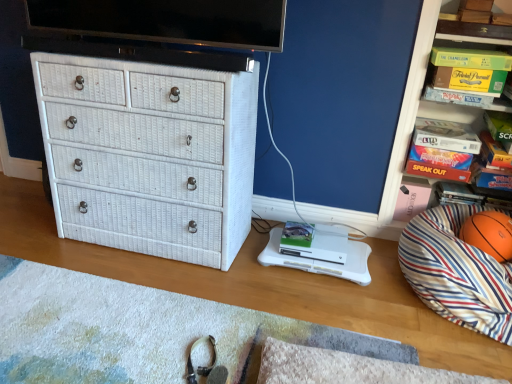
What do you see at coordinates (489, 234) in the screenshot?
I see `orange rubber basketball at right` at bounding box center [489, 234].

The image size is (512, 384). What are the coordinates of `orange matte basketball at right` in the screenshot? It's located at (426, 72).

Is white wicker chest of drawers at left directly adjacent to orange rubber basketball at right?

No, white wicker chest of drawers at left is not making contact with orange rubber basketball at right.

From the picture: Which point is more distant from viewer, (65, 88) or (473, 236)?

The point (473, 236) is farther from the camera.

Between white wicker chest of drawers at left and orange rubber basketball at right, which one has larger size?

white wicker chest of drawers at left is bigger.

Does point (362, 348) appear closer or farther from the camera than point (431, 52)?

Point (362, 348) is closer to the camera than point (431, 52).

Which object is wider, white textured mat at lower center or green cardboard game at upper right?

With larger width is white textured mat at lower center.

Find the location of `book that is on the right side of white textured mat at lower center`. book that is on the right side of white textured mat at lower center is located at coordinates (471, 58).

Is white textured mat at lower center in front of or behind green cardboard game at upper right in the image?

Visually, white textured mat at lower center is located in front of green cardboard game at upper right.

Based on the photo, from the image's perspective, which one is positioned higher, orange matte basketball at right or green cardboard game at upper right?

green cardboard game at upper right is shown above in the image.

You are a GUI agent. You are given a task and a screenshot of the screen. Output one action in this format:
    pyautogui.click(x=<x>, y=<y>)
    Task: Click on the book behind the orange matte basketball at right
    The width and height of the screenshot is (512, 384).
    Given the screenshot: What is the action you would take?
    pyautogui.click(x=471, y=58)

Who is shorter, orange matte basketball at right or green cardboard game at upper right?

Standing shorter between the two is green cardboard game at upper right.

From a real-world perspective, is black glossy flat-screen tv at upper center physically located above or below green cardboard game at upper right?

From a real-world perspective, black glossy flat-screen tv at upper center is physically above green cardboard game at upper right.

Is black glossy flat-screen tv at upper center with green cardboard game at upper right?

There is a gap between black glossy flat-screen tv at upper center and green cardboard game at upper right.

Which object is positioned more to the right, black glossy flat-screen tv at upper center or green cardboard game at upper right?

green cardboard game at upper right is more to the right.

Is green cardboard box at upper right positioned before green cardboard game at upper right?

No.

Considering the relative sizes of green cardboard box at upper right and green cardboard game at upper right in the image provided, is green cardboard box at upper right shorter than green cardboard game at upper right?

No.

Is green cardboard box at upper right aimed at green cardboard game at upper right?

No, green cardboard box at upper right is not aimed at green cardboard game at upper right.

Is striped fabric bean bag at right oriented towards black glossy flat-screen tv at upper center?

No, striped fabric bean bag at right does not turn towards black glossy flat-screen tv at upper center.

Is striped fabric bean bag at right not near black glossy flat-screen tv at upper center?

Indeed, striped fabric bean bag at right is not near black glossy flat-screen tv at upper center.

Based on the photo, in terms of width, does striped fabric bean bag at right look wider or thinner when compared to black glossy flat-screen tv at upper center?

striped fabric bean bag at right is wider than black glossy flat-screen tv at upper center.

Based on the photo, considering the relative positions of striped fabric bean bag at right and black glossy flat-screen tv at upper center in the image provided, is striped fabric bean bag at right in front of black glossy flat-screen tv at upper center?

Yes.

Does point (217, 255) appear closer or farther from the camera than point (256, 342)?

Point (217, 255) is farther from the camera than point (256, 342).

Looking at their sizes, would you say white wicker chest of drawers at left is wider or thinner than white textured mat at lower center?

Clearly, white wicker chest of drawers at left has less width compared to white textured mat at lower center.

How many degrees apart are the facing directions of white wicker chest of drawers at left and white textured mat at lower center?

They differ by 180 degrees in their facing directions.

From the image's perspective, which one is positioned lower, white wicker chest of drawers at left or white textured mat at lower center?

white textured mat at lower center is shown below in the image.

You are a GUI agent. You are given a task and a screenshot of the screen. Output one action in this format:
    pyautogui.click(x=<x>, y=<y>)
    Task: Click on the chest of drawers on the left of orange rubber basketball at right
    This screenshot has height=384, width=512.
    Given the screenshot: What is the action you would take?
    pyautogui.click(x=149, y=155)

The height and width of the screenshot is (384, 512). I want to click on book behind the white textured mat at lower center, so click(x=471, y=58).

When comparing their distances from orange rubber basketball at right, does green cardboard game at upper right or orange matte basketball at right seem closer?

Based on the image, orange matte basketball at right appears to be nearer to orange rubber basketball at right.

When comparing their distances from striped fabric bean bag at right, does green cardboard game at upper right or white textured mat at lower center seem closer?

white textured mat at lower center is positioned closer to the anchor striped fabric bean bag at right.

When comparing their distances from white textured mat at lower center, does orange rubber basketball at right or white wicker chest of drawers at left seem further?

Based on the image, orange rubber basketball at right appears to be further to white textured mat at lower center.

Estimate the real-world distances between objects in this image. Which object is closer to black glossy flat-screen tv at upper center, green cardboard game at upper right or white textured mat at lower center?

green cardboard game at upper right.

Based on their spatial positions, is orange rubber basketball at right or black glossy flat-screen tv at upper center further from green cardboard box at upper right?

Among the two, black glossy flat-screen tv at upper center is located further to green cardboard box at upper right.

Based on their spatial positions, is striped fabric bean bag at right or orange matte basketball at right closer to white textured mat at lower center?

Based on the image, striped fabric bean bag at right appears to be nearer to white textured mat at lower center.

Considering their positions, is green cardboard box at upper right positioned closer to green cardboard game at upper right than orange matte basketball at right?

The object closer to green cardboard game at upper right is green cardboard box at upper right.

Looking at the image, which one is located closer to orange rubber basketball at right, striped fabric bean bag at right or white textured mat at lower center?

striped fabric bean bag at right lies closer to orange rubber basketball at right than the other object.

Identify the location of magazine between green cardboard game at upper right and orange rubber basketball at right from top to bottom. (467, 79).

Where is `ball between green cardboard game at upper right and striped fabric bean bag at right in the vertical direction`? ball between green cardboard game at upper right and striped fabric bean bag at right in the vertical direction is located at coordinates (489, 234).

Locate an element on the screen. The height and width of the screenshot is (384, 512). book located between white textured mat at lower center and orange rubber basketball at right in the left-right direction is located at coordinates click(x=471, y=58).

Locate an element on the screen. The height and width of the screenshot is (384, 512). magazine between white wicker chest of drawers at left and green cardboard game at upper right is located at coordinates (467, 79).